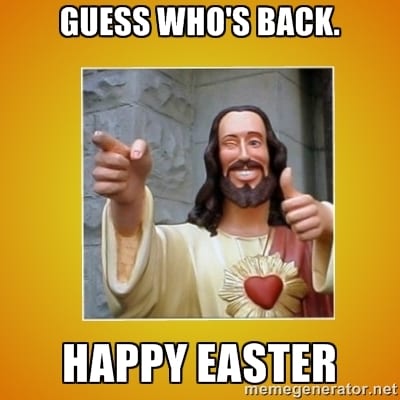
Find the location of a particular element. robe is located at coordinates click(x=162, y=262).